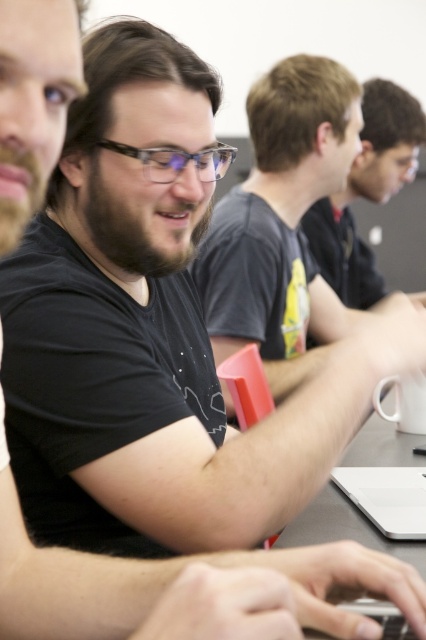
Can you confirm if matte black t-shirt at center is wider than dark gray t-shirt at upper right?

Yes, matte black t-shirt at center is wider than dark gray t-shirt at upper right.

Can you confirm if matte black t-shirt at center is smaller than dark gray t-shirt at upper right?

No, matte black t-shirt at center is not smaller than dark gray t-shirt at upper right.

Where is `matte black t-shirt at center`? This screenshot has height=640, width=426. matte black t-shirt at center is located at coordinates (282, 224).